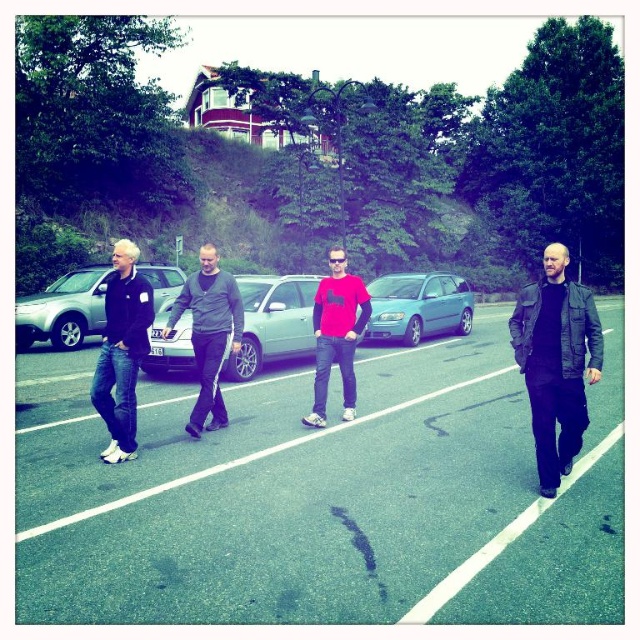
You are a pedestrian trying to cross the road where the silver metallic sedan at center and dark gray sweater at center are located. Considering their sizes, which one would block your view more if standing in front of you?

The silver metallic sedan at center is larger in size than the dark gray sweater at center, so it would block your view more if standing in front of you.